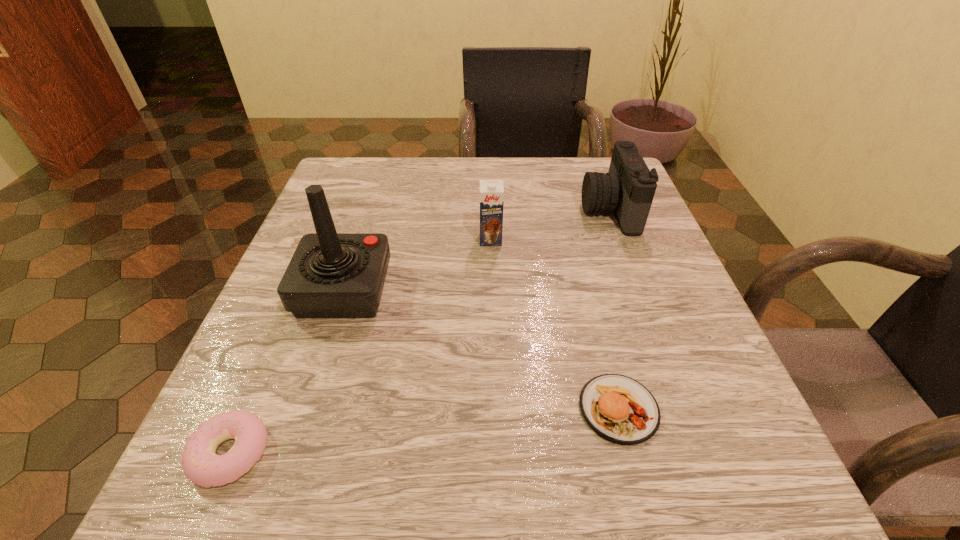
The width and height of the screenshot is (960, 540). Find the location of `object identified as the second closest to the camera`. object identified as the second closest to the camera is located at coordinates (618, 408).

The width and height of the screenshot is (960, 540). In order to click on free space that satisfies the following two spatial constraints: 1. on the front label of the third object from left to right; 2. on the front-facing side of the joystick in this screenshot , I will do `click(492, 289)`.

This screenshot has width=960, height=540. I want to click on free spot that satisfies the following two spatial constraints: 1. on the front label of the third object from right to left; 2. on the right side of the second shortest object, so click(x=495, y=409).

This screenshot has width=960, height=540. I want to click on free region that satisfies the following two spatial constraints: 1. at the lens of the camera; 2. on the front side of the doughnut, so click(701, 453).

Where is `vacant area in the image that satisfies the following two spatial constraints: 1. on the front label of the chocolate milk; 2. on the front-facing side of the third farthest object`? The image size is (960, 540). vacant area in the image that satisfies the following two spatial constraints: 1. on the front label of the chocolate milk; 2. on the front-facing side of the third farthest object is located at coordinates (492, 289).

The height and width of the screenshot is (540, 960). I want to click on free space in the image that satisfies the following two spatial constraints: 1. at the lens of the camera; 2. on the front label of the third object from left to right, so click(x=620, y=239).

In order to click on free space in the image that satisfies the following two spatial constraints: 1. on the front-facing side of the patty; 2. on the right side of the joystick in this screenshot , I will do `click(305, 409)`.

The height and width of the screenshot is (540, 960). What are the coordinates of `free space that satisfies the following two spatial constraints: 1. on the front label of the third object from right to left; 2. on the front-facing side of the third farthest object` in the screenshot? It's located at (492, 289).

Where is `vacant space that satisfies the following two spatial constraints: 1. on the front-facing side of the third nearest object; 2. on the left side of the patty`? The width and height of the screenshot is (960, 540). vacant space that satisfies the following two spatial constraints: 1. on the front-facing side of the third nearest object; 2. on the left side of the patty is located at coordinates (305, 409).

This screenshot has width=960, height=540. What are the coordinates of `vacant space that satisfies the following two spatial constraints: 1. on the back side of the second shortest object; 2. on the front-facing side of the joystick` in the screenshot? It's located at (588, 289).